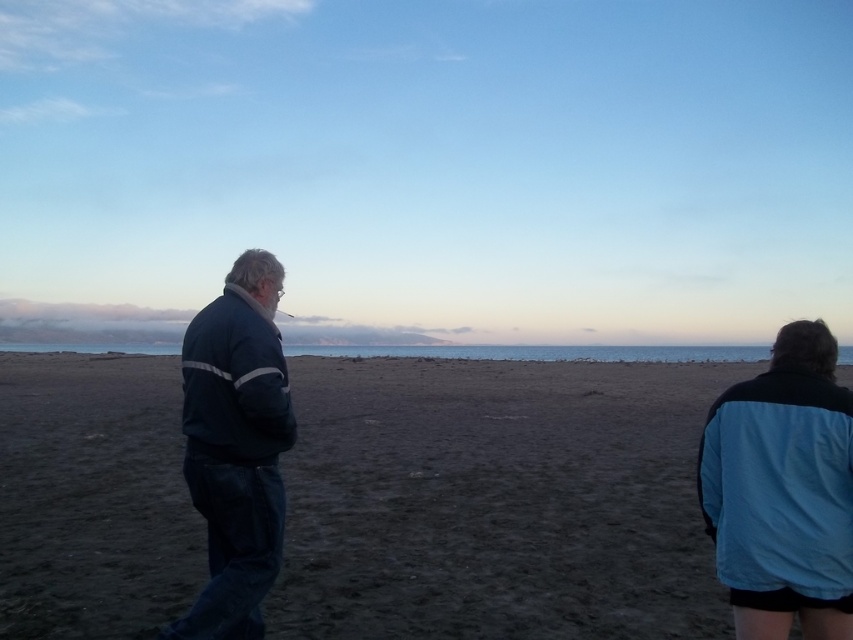
You are a photographer trying to capture a photo of both the blue fabric jacket at lower right and the dark blue fabric jacket at left. Since you want them both in the frame, which direction should you move to ensure both jackets are visible?

→ You should move to the left to ensure both the blue fabric jacket at lower right and the dark blue fabric jacket at left are visible in the frame.

You are standing at the center of the beach and want to walk directly to the blue fabric jacket at lower right. Which direction should you head towards?

Since the blue fabric jacket at lower right is located at point 0.767 on the x and 0.919 on the y axis, you should head towards the lower right direction to reach it.